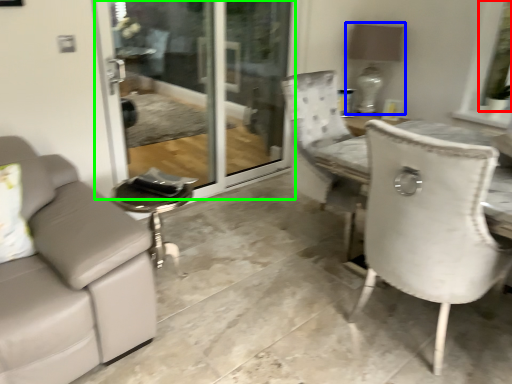
Question: Which object is positioned farthest from window screen (highlighted by a red box)? Select from lamp (highlighted by a blue box) and screen door (highlighted by a green box).

Choices:
 (A) lamp
 (B) screen door

Answer: (B)